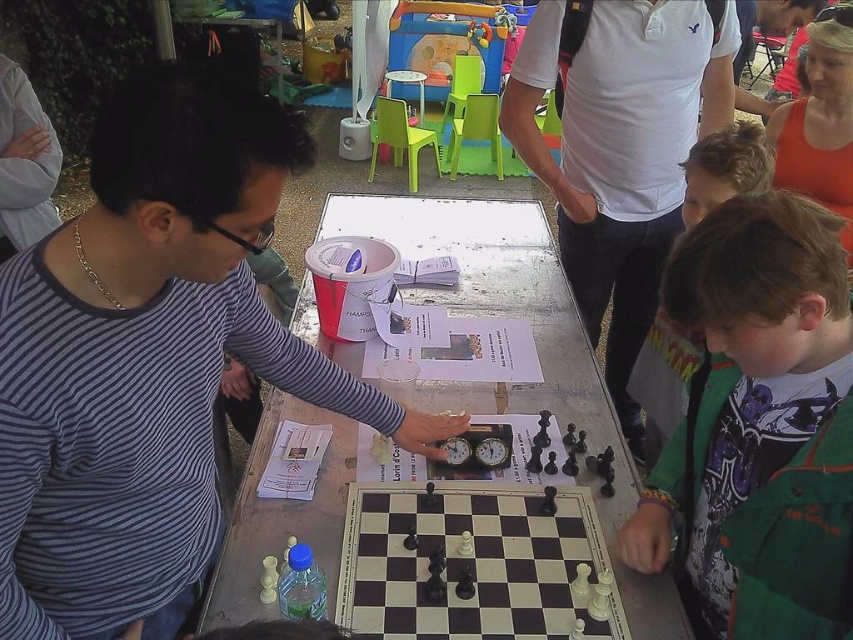
Question: Which is farther from the white cotton shirt at center?

Choices:
 (A) green textured jacket at lower right
 (B) striped cotton shirt at left
 (C) wooden chessboard at center

Answer: (B)

Question: Can you confirm if white cotton shirt at center is positioned below green fleece jacket at right?

Choices:
 (A) yes
 (B) no

Answer: (B)

Question: Which point appears farthest from the camera in this image?

Choices:
 (A) (656, 348)
 (B) (589, 502)

Answer: (A)

Question: Is wooden chessboard at center wider than green fleece jacket at right?

Choices:
 (A) no
 (B) yes

Answer: (B)

Question: Which point is farther to the camera?

Choices:
 (A) (9, 452)
 (B) (773, 554)
 (C) (706, 140)
 (D) (589, 328)

Answer: (D)

Question: Is wooden chessboard at center further to camera compared to green fleece jacket at right?

Choices:
 (A) no
 (B) yes

Answer: (A)